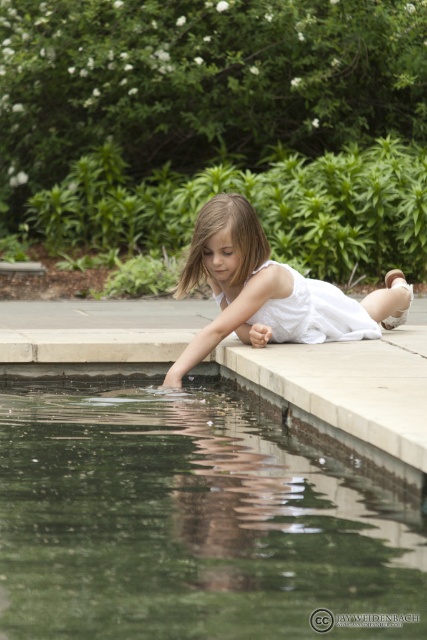
You are a drone operator trying to capture the girl in the image. You have two points marked on your screen, point A at coordinates point (231, 464) and point B at coordinates point (281, 314). To ensure the girl is centered in your shot, which point should you focus on first?

Point A at coordinates point (231, 464) is in front of point B at coordinates point (281, 314), so you should focus on point A first to center the girl in your shot.

You are a photographer trying to capture the reflection of the girl in the water. The girl is on the concrete ledge at the edge of the water. You notice a specific point marked as point (x=193, y=518). What does this point represent in the scene?

The point (x=193, y=518) indicates green reflective water at lower center, which is where the reflection of the girl would be captured.